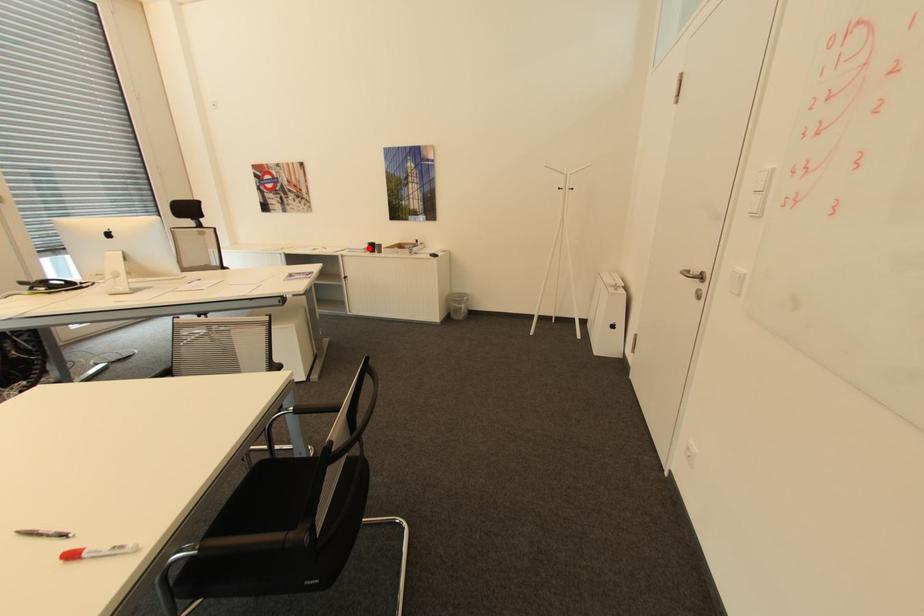
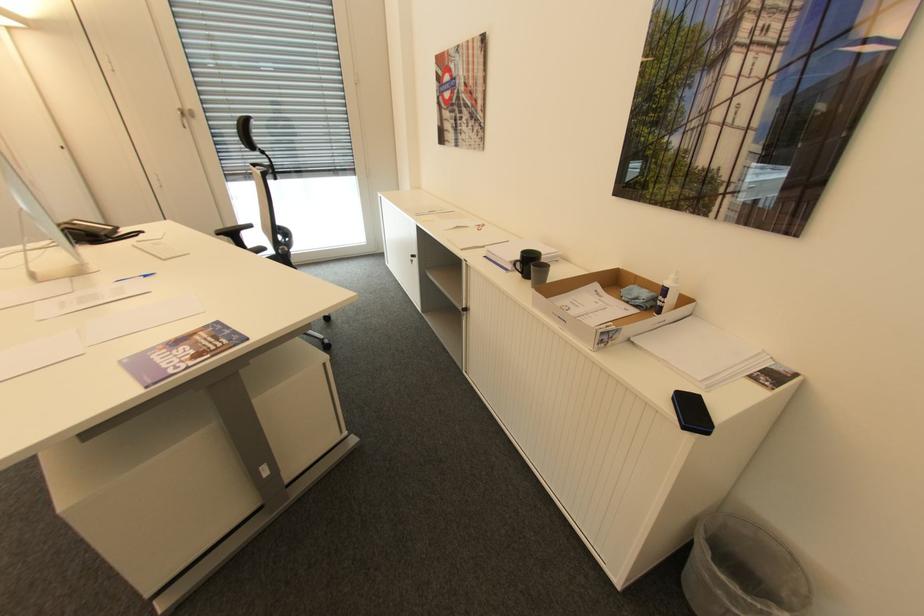
Where in the second image is the point corresponding to the highlighted location from the first image?

(516, 262)